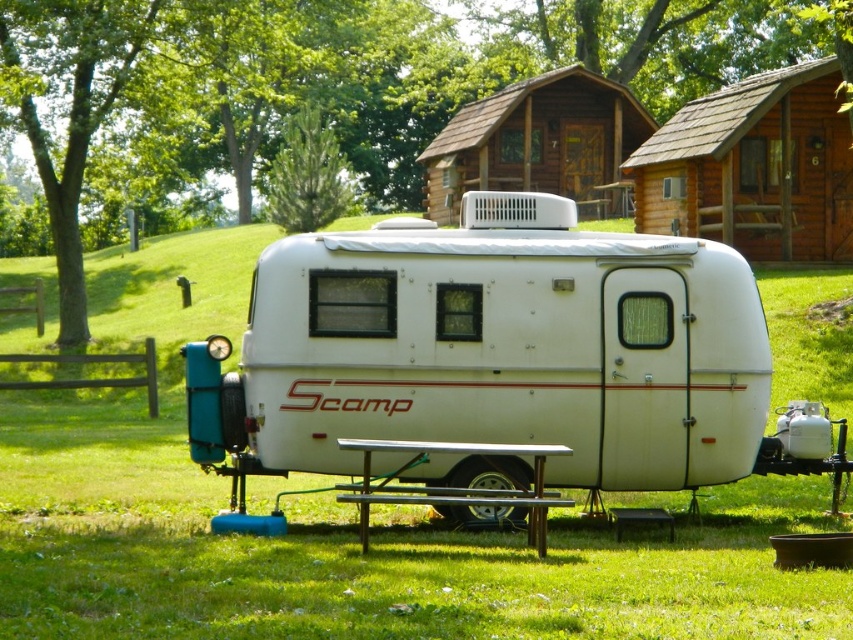
Question: Which of the following is the closest to the observer?

Choices:
 (A) (550, 84)
 (B) (524, 490)
 (C) (288, 138)

Answer: (B)

Question: Can you confirm if metallic silver picnic table at lower center is positioned to the left of green leafy tree at upper center?

Choices:
 (A) yes
 (B) no

Answer: (B)

Question: Estimate the real-world distances between objects in this image. Which object is farther from the white matte recreational vehicle at center?

Choices:
 (A) brown wooden log cabin at upper center
 (B) green leafy tree at upper center
 (C) brown wooden log cabin at upper right

Answer: (B)

Question: Which of these objects is positioned closest to the metallic silver picnic table at lower center?

Choices:
 (A) green leafy tree at center
 (B) brown wooden log cabin at upper right
 (C) green leafy tree at upper center
 (D) white matte recreational vehicle at center

Answer: (D)

Question: Is brown wooden log cabin at upper right above green leafy tree at upper center?

Choices:
 (A) no
 (B) yes

Answer: (A)

Question: Does white matte recreational vehicle at center have a greater width compared to brown wooden log cabin at upper right?

Choices:
 (A) no
 (B) yes

Answer: (B)